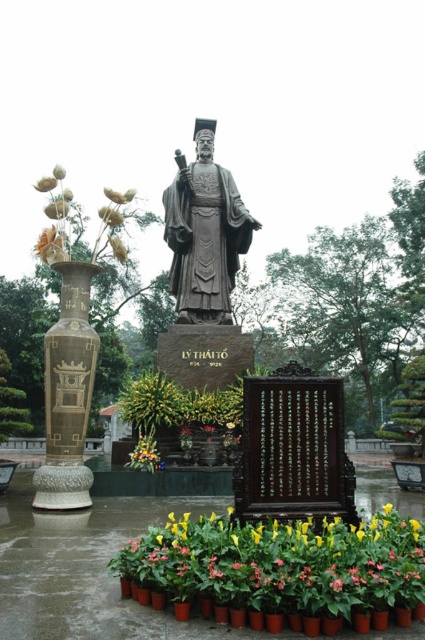
You are a visitor at the statue of a historical figure named Lys Thai To. You notice the floral arrangement at lower center and the stone statue at center. Which object takes up more space in the scene?

The stone statue at center occupies more space than the floral arrangement at lower center.

You are a tour guide explaining the historical statue to visitors. You mention the stone statue at center and the yellow matte flower at center. Which object is taller?

The stone statue at center is taller than the yellow matte flower at center.